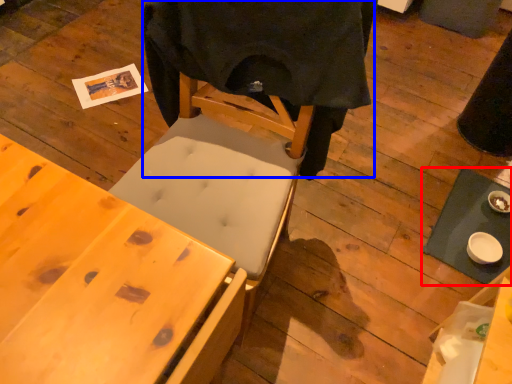
Question: Among these objects, which one is nearest to the camera, table (highlighted by a red box) or cloth (highlighted by a blue box)?

Choices:
 (A) table
 (B) cloth

Answer: (B)